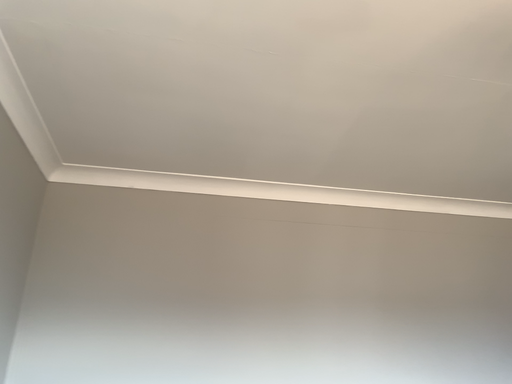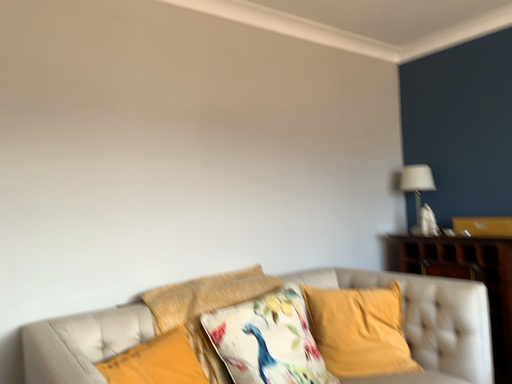
Question: Which way did the camera rotate in the video?

Choices:
 (A) rotated left
 (B) rotated right

Answer: (B)